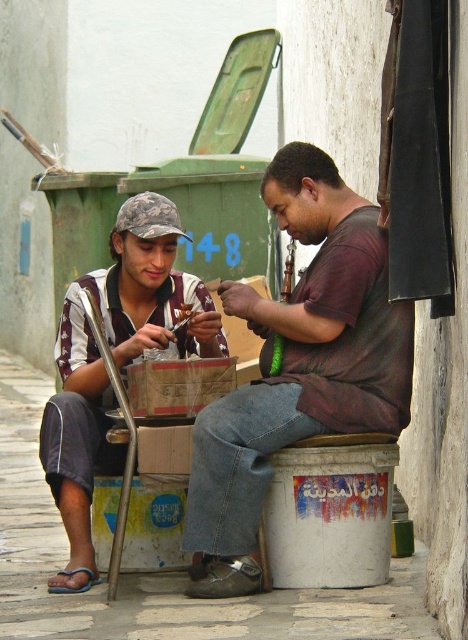
Does dark brown leather shirt at center have a smaller size compared to camouflage fabric cap at left?

Indeed, dark brown leather shirt at center has a smaller size compared to camouflage fabric cap at left.

Can you confirm if dark brown leather shirt at center is positioned below camouflage fabric cap at left?

No.

Which is behind, point (378, 228) or point (82, 481)?

Positioned behind is point (82, 481).

This screenshot has width=468, height=640. In order to click on dark brown leather shirt at center in this screenshot , I will do `click(298, 365)`.